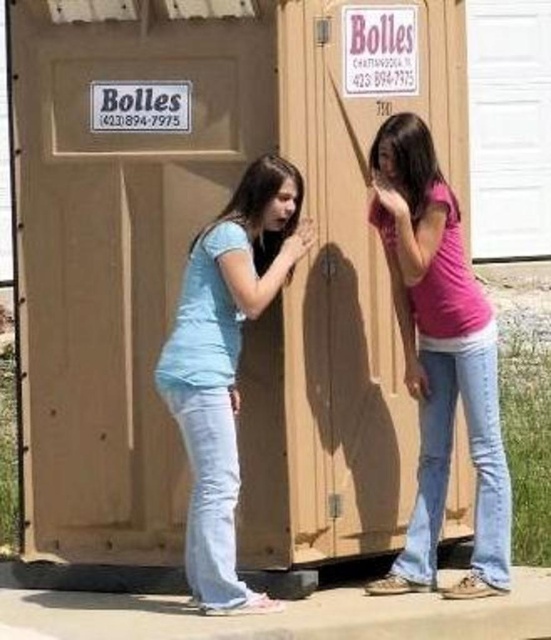
Between pink matte shirt at center and matte blue shirt at center, which one has more height?

With more height is pink matte shirt at center.

Is point (505, 465) farther from viewer compared to point (268, 179)?

Yes, it is behind point (268, 179).

The image size is (551, 640). I want to click on pink matte shirt at center, so click(440, 358).